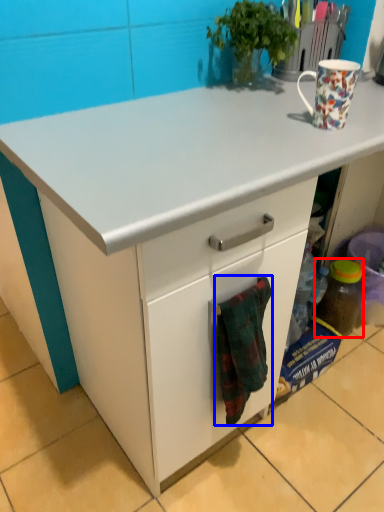
Question: Which of the following is the closest to the observer, bottle (highlighted by a red box) or blanket (highlighted by a blue box)?

Choices:
 (A) bottle
 (B) blanket

Answer: (B)